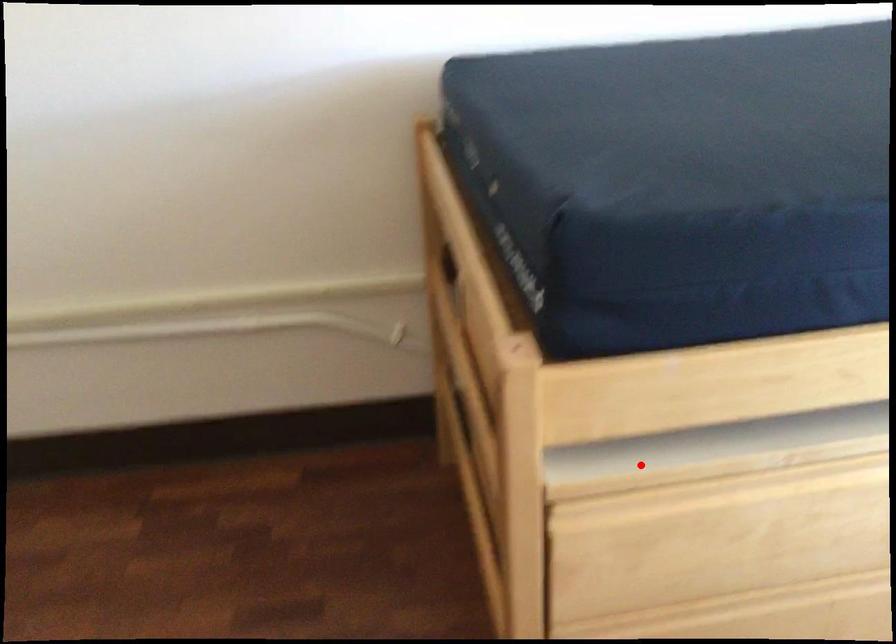
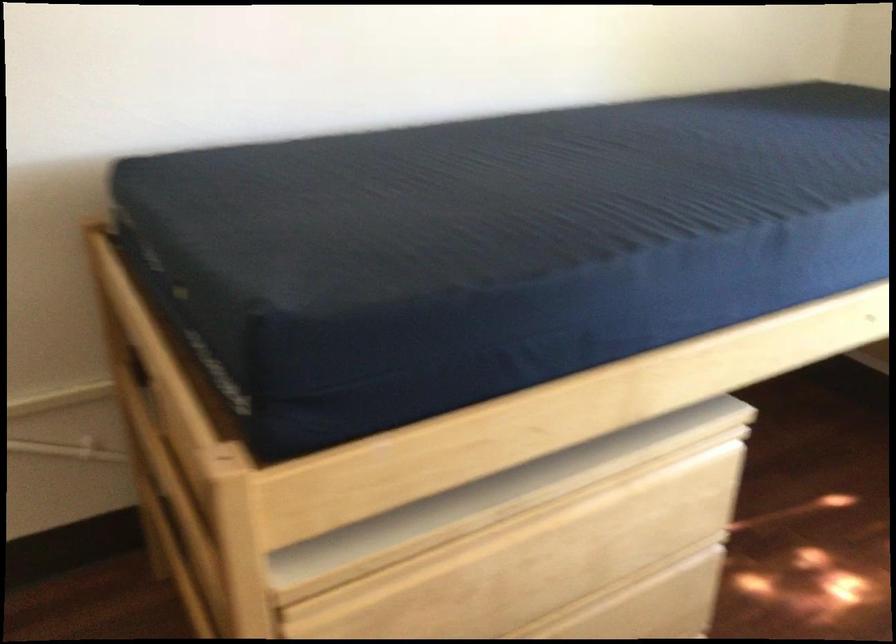
In the second image, find the point that corresponds to the highlighted location in the first image.

(366, 554)